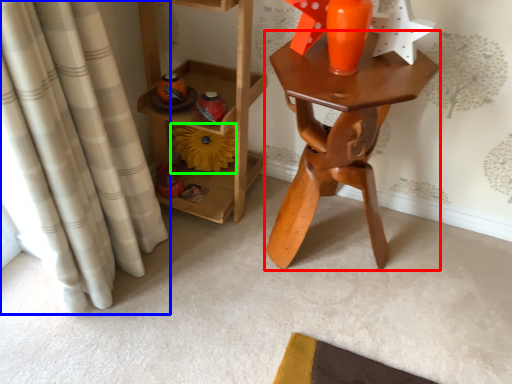
Question: Based on their relative distances, which object is farther from table (highlighted by a red box)? Choose from curtain (highlighted by a blue box) and flower (highlighted by a green box).

Choices:
 (A) curtain
 (B) flower

Answer: (A)